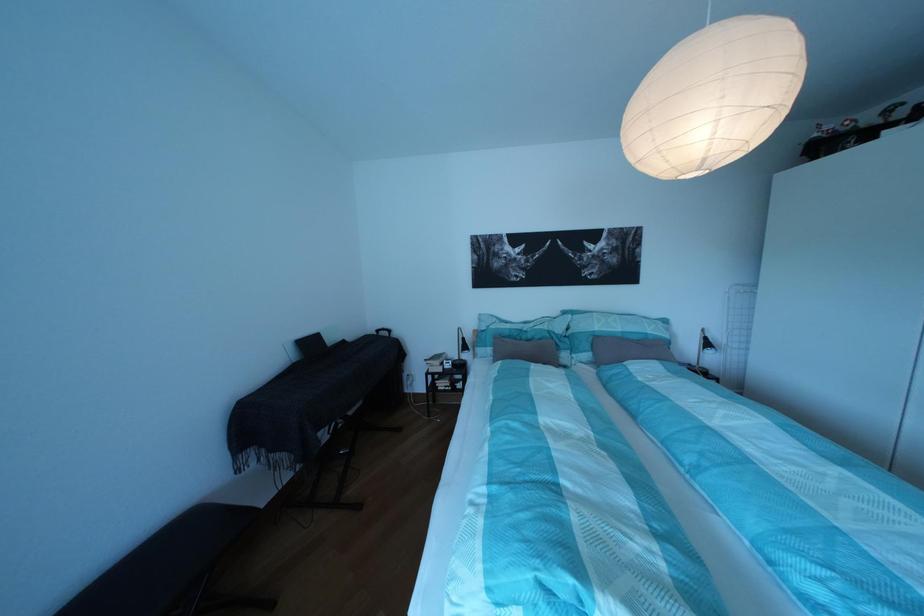
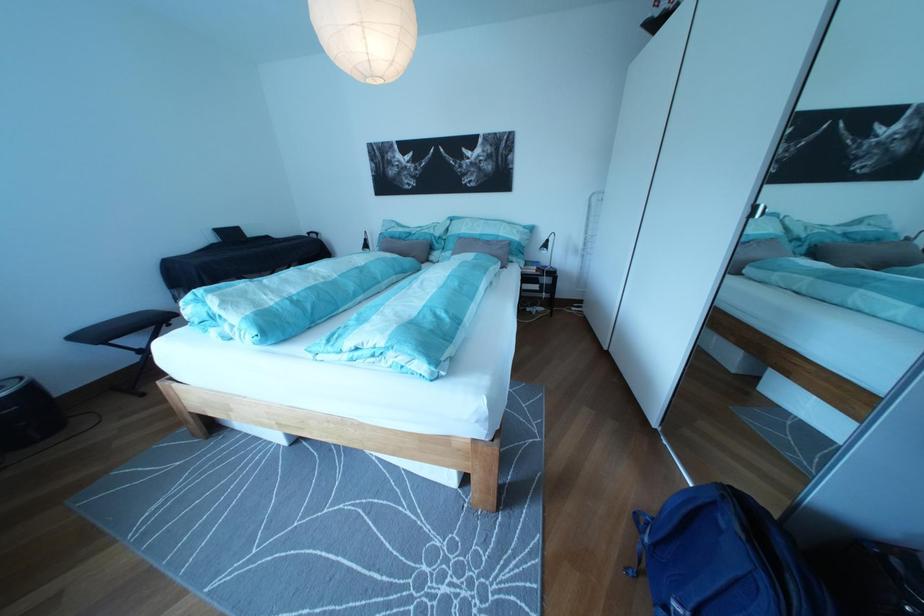
Question: What movement of the cameraman would produce the second image?

Choices:
 (A) Left
 (B) Right
 (C) Forward
 (D) Backward

Answer: (B)